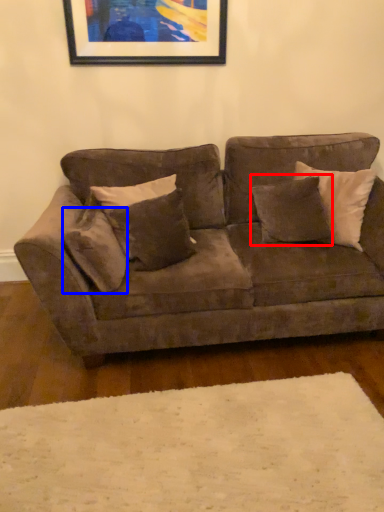
Question: Which of the following is the closest to the observer, pillow (highlighted by a red box) or pillow (highlighted by a blue box)?

Choices:
 (A) pillow
 (B) pillow

Answer: (B)